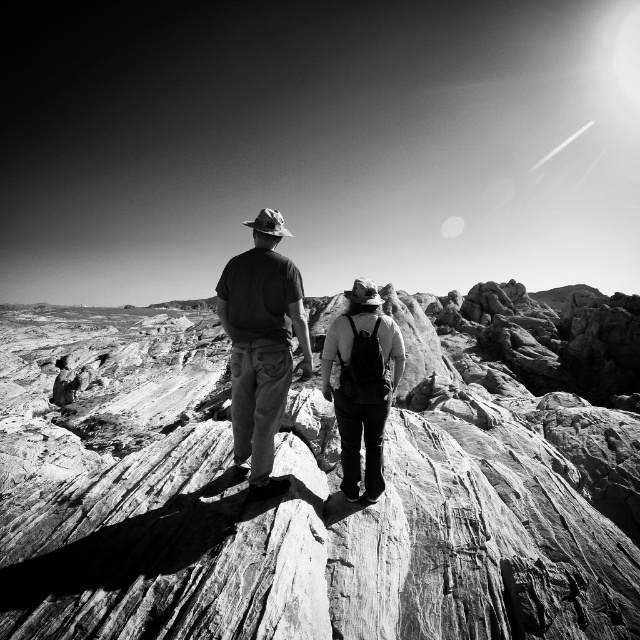
Can you confirm if dark gray cotton shirt at center is thinner than matte black backpack at center?

No.

Who is positioned more to the right, dark gray cotton shirt at center or matte black backpack at center?

matte black backpack at center is more to the right.

Consider the image. Who is more forward, (288, 284) or (349, 323)?

Point (288, 284)

I want to click on dark gray cotton shirt at center, so click(260, 346).

Can you confirm if rugged stone rock at center is shorter than matte black backpack at center?

No, rugged stone rock at center is not shorter than matte black backpack at center.

Is rugged stone rock at center above matte black backpack at center?

Indeed, rugged stone rock at center is positioned over matte black backpack at center.

Between point (556, 499) and point (324, 394), which one is positioned in front?

Point (324, 394) is more forward.

Locate an element on the screen. rugged stone rock at center is located at coordinates (321, 483).

Find the location of a particular element. rugged stone rock at center is located at coordinates (321, 483).

Does rugged stone rock at center have a larger size compared to dark gray cotton shirt at center?

Indeed, rugged stone rock at center has a larger size compared to dark gray cotton shirt at center.

Is point (499, 353) more distant than point (298, 321)?

Yes, point (499, 353) is behind point (298, 321).

The height and width of the screenshot is (640, 640). I want to click on rugged stone rock at center, so click(x=321, y=483).